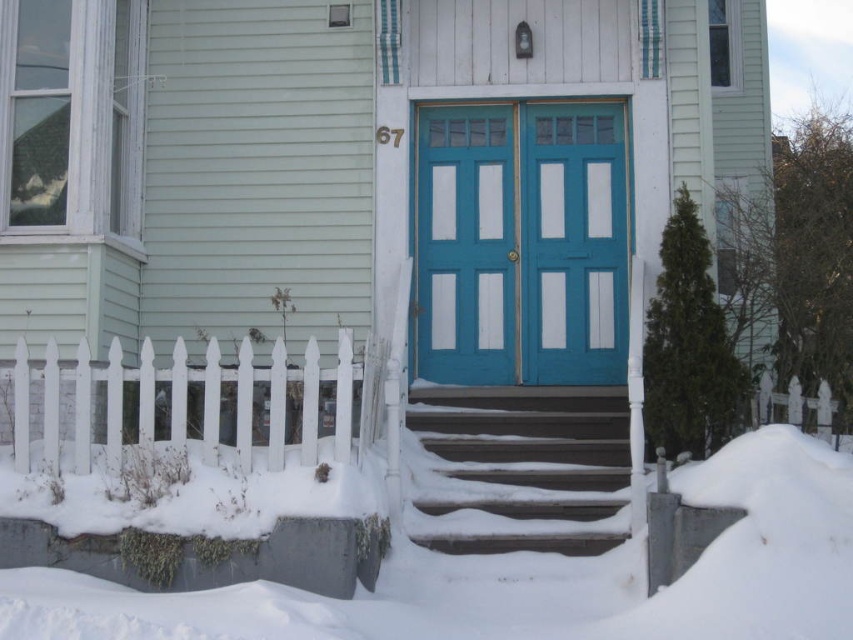
You are a delivery person with a box that is 1 meter tall. You need to place the box on the ground near the entrance. The white fluffy snow at lower center and smooth gray stairs at center are the only flat surfaces available. Can you safely place the box without it touching either surface?

The white fluffy snow at lower center and smooth gray stairs at center are 96.74 centimeters apart from each other. Since the box is 1 meter tall, which is taller than the distance between them, placing it between them would cause the box to touch both surfaces. Therefore, you cannot safely place the box without it touching either surface.

You are a delivery person trying to deliver a package to the teal painted wood door at center. However, the white fluffy snow at lower center is blocking the path. Can you step over the snow to reach the door?

The white fluffy snow at lower center is larger in size than the teal painted wood door at center, so it might be difficult to step over the snow to reach the door as it covers a larger area.